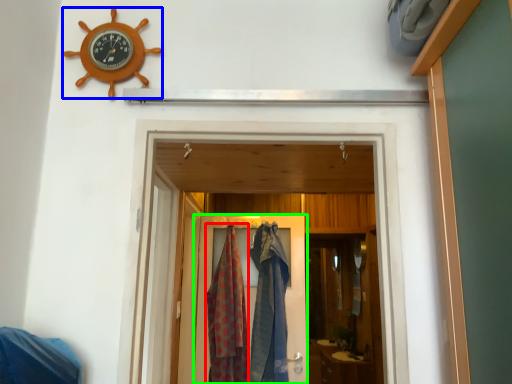
Question: Which is nearer to the clothing (highlighted by a red box)? wall clock (highlighted by a blue box) or door (highlighted by a green box).

Choices:
 (A) wall clock
 (B) door

Answer: (B)